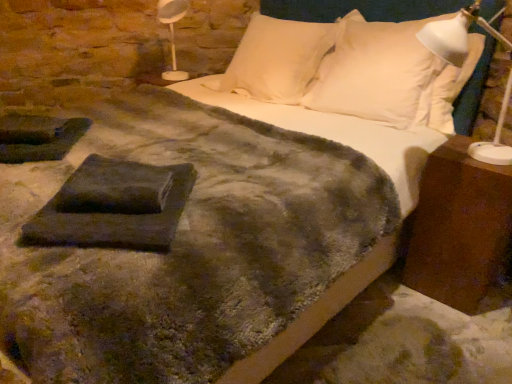
Question: From the image's perspective, is dark gray felt at center located above or below white soft pillow at upper right, which is the second pillow in left-to-right order?

Choices:
 (A) below
 (B) above

Answer: (A)

Question: Looking at their shapes, would you say dark gray felt at center is wider or thinner than white soft pillow at upper right, which is the second pillow in left-to-right order?

Choices:
 (A) wide
 (B) thin

Answer: (A)

Question: Which object is positioned closest to the dark gray felt at center?

Choices:
 (A) white soft pillow at upper center, placed as the first pillow when sorted from left to right
 (B) white plastic table lamp at upper left
 (C) brown wood nightstand at right
 (D) white plastic lamp at right
 (E) white soft pillow at upper right, which is the first pillow in right-to-left order

Answer: (C)

Question: Estimate the real-world distances between objects in this image. Which object is farther from the white plastic table lamp at upper left?

Choices:
 (A) white soft pillow at upper center, placed as the first pillow when sorted from left to right
 (B) dark gray felt at center
 (C) white soft pillow at upper right, which is the second pillow in left-to-right order
 (D) brown wood nightstand at right
 (E) white plastic lamp at right

Answer: (D)